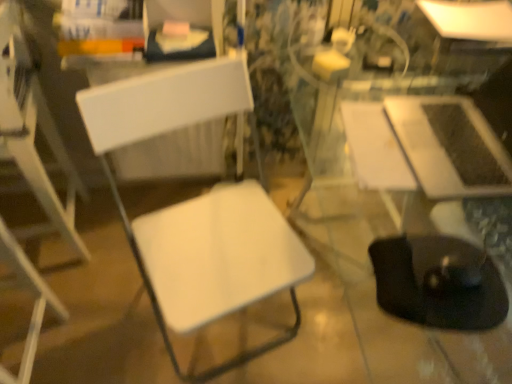
Identify the location of free point to the right of white plastic chair at left, the 1th chair when ordered from left to right. This screenshot has height=384, width=512. (114, 347).